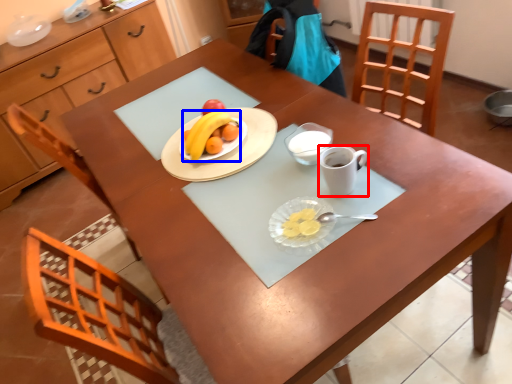
Question: Which of the following is the closest to the observer, coffee cup (highlighted by a red box) or grapefruit (highlighted by a blue box)?

Choices:
 (A) coffee cup
 (B) grapefruit

Answer: (A)